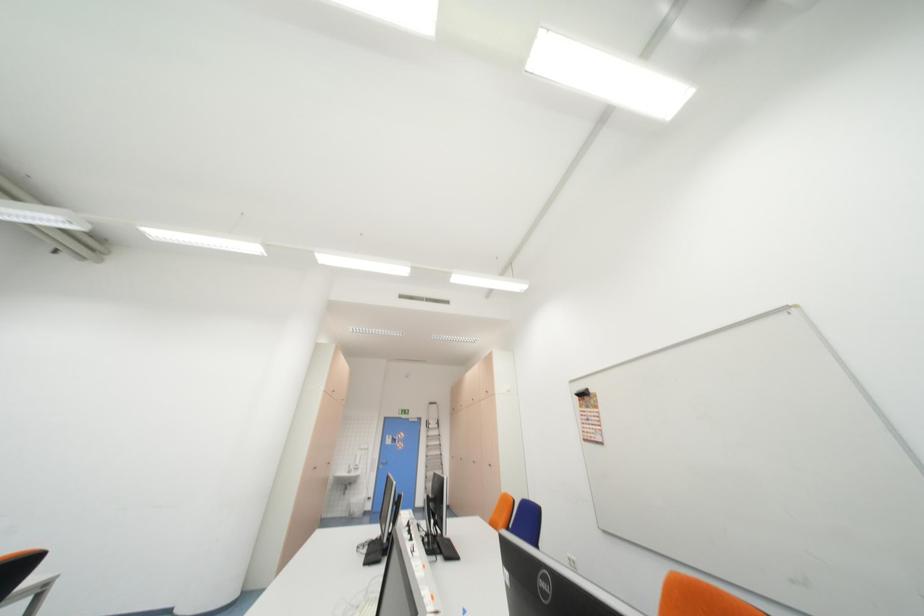
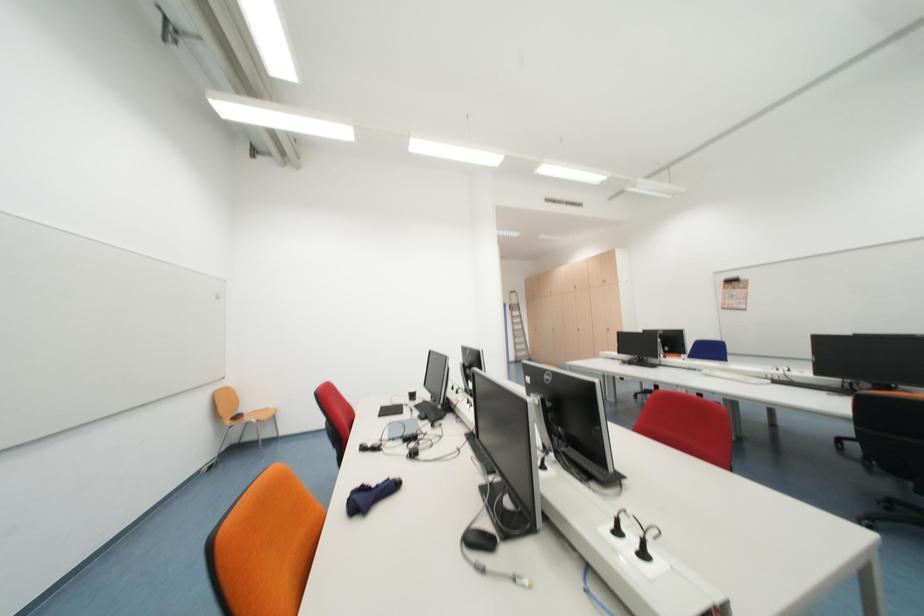
Question: The images are taken continuously from a first-person perspective. In which direction are you moving?

Choices:
 (A) Left
 (B) Right
 (C) Forward
 (D) Backward

Answer: (A)